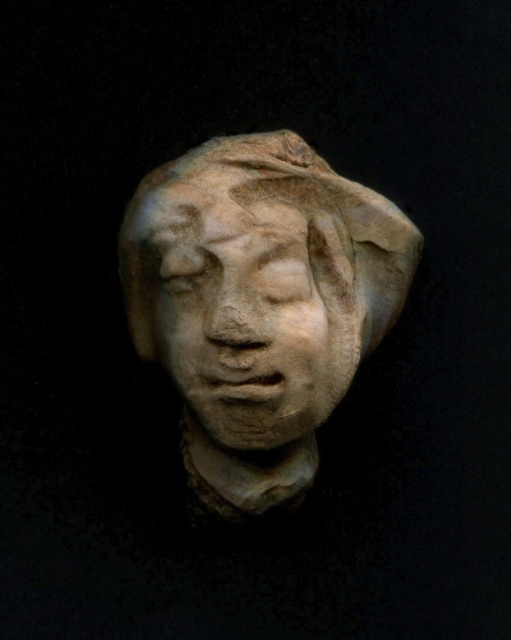
Question: Which point is farther to the camera?

Choices:
 (A) matte stone head at center
 (B) matte stone face at center

Answer: (A)

Question: Does matte stone head at center have a smaller size compared to matte stone face at center?

Choices:
 (A) yes
 (B) no

Answer: (B)

Question: Is matte stone head at center above matte stone face at center?

Choices:
 (A) no
 (B) yes

Answer: (A)

Question: Does matte stone head at center have a larger size compared to matte stone face at center?

Choices:
 (A) no
 (B) yes

Answer: (B)

Question: Which point is farther to the camera?

Choices:
 (A) matte stone head at center
 (B) matte stone face at center

Answer: (A)